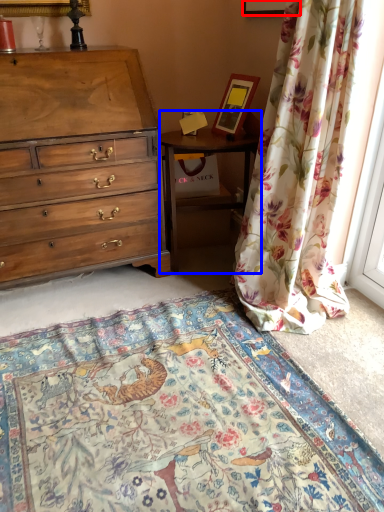
Question: Which point is further to the camera, picture frame (highlighted by a red box) or nightstand (highlighted by a blue box)?

Choices:
 (A) picture frame
 (B) nightstand

Answer: (B)